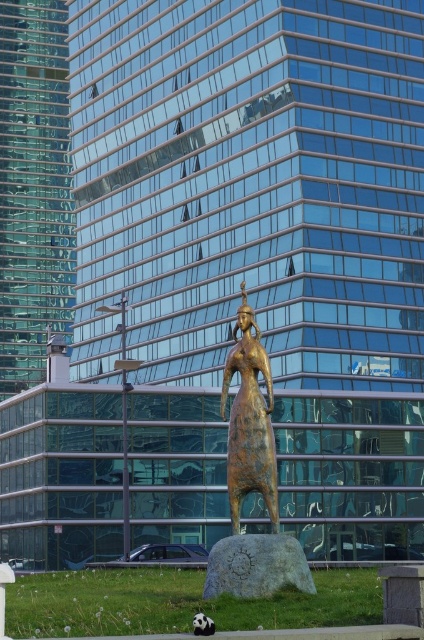
You are an urban planner assessing the central square. You see the bronze statue at center and the rusty metallic statue at center. Which statue is wider?

The rusty metallic statue at center is wider than the bronze statue at center.

You are an urban planner assessing the placement of statues in a new city plaza. The plaza has a strict rule that statues must be at least 10 feet apart to ensure visitors can move freely between them. Given the bronze statue at center and the rusty metallic statue at center, do these two statues comply with the plaza regulations?

The bronze statue at center is 7.12 feet from the rusty metallic statue at center, which is less than the required 10 feet. Therefore, the statues do not comply with the plaza regulations.

You are standing in front of the skyscraper and want to take a photo of the statue. You notice two points marked on the statue. Which point is closer to your camera, point (237,480) or point (295,570)?

Point (237,480) is further to the camera than point (295,570), so point (295,570) is closer to the camera.